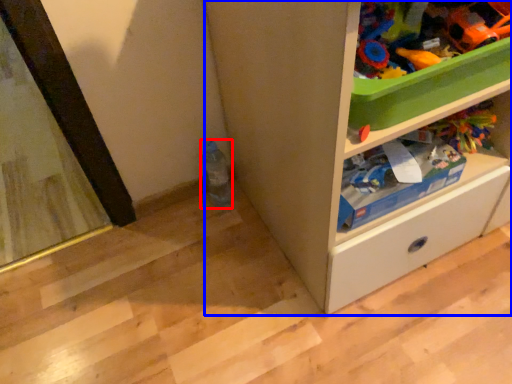
Question: Which object appears farthest to the camera in this image, bottle (highlighted by a red box) or cabinetry (highlighted by a blue box)?

Choices:
 (A) bottle
 (B) cabinetry

Answer: (A)